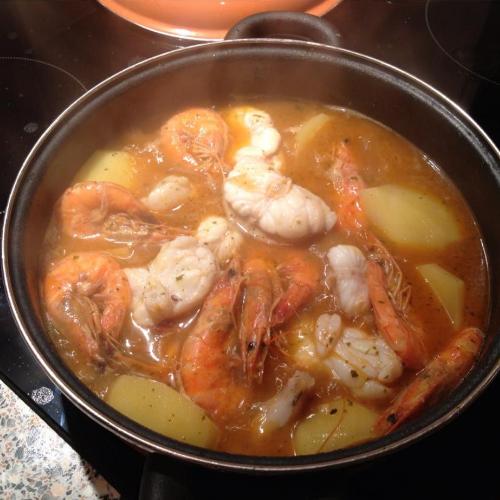
This screenshot has height=500, width=500. What are the coordinates of `bottom of pot` in the screenshot? It's located at (118, 482).